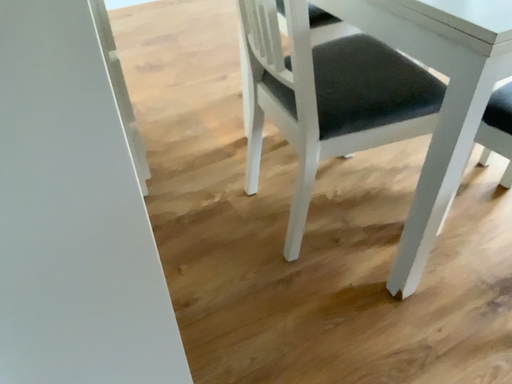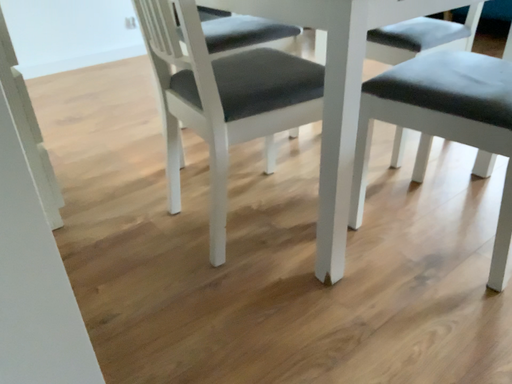
Question: How did the camera likely rotate when shooting the video?

Choices:
 (A) rotated upward
 (B) rotated downward

Answer: (A)